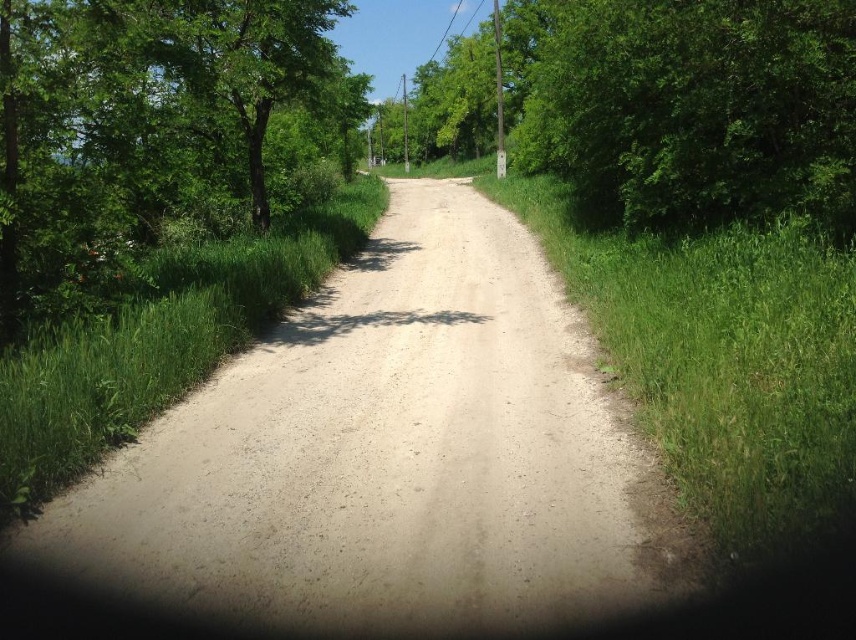
You are a hiker walking along the rural dirt road and want to know which object, the green leafy tree at center or the green grass at left, is wider. Which one is wider?

The green leafy tree at center is wider than the green grass at left.

You are standing at point [152,129] on the dirt road. What is the closest object to you?

The closest object to you at point [152,129] is the green leafy tree at left.

Consider the image. You are standing at the center of the road and want to take a photo of the green leafy tree at left. Based on its 2D location coordinates, in which direction should you point your camera to capture it?

The green leafy tree at left is located at coordinates point (152, 129), which is to the left side of the road. Therefore, you should point your camera to the left to capture it.